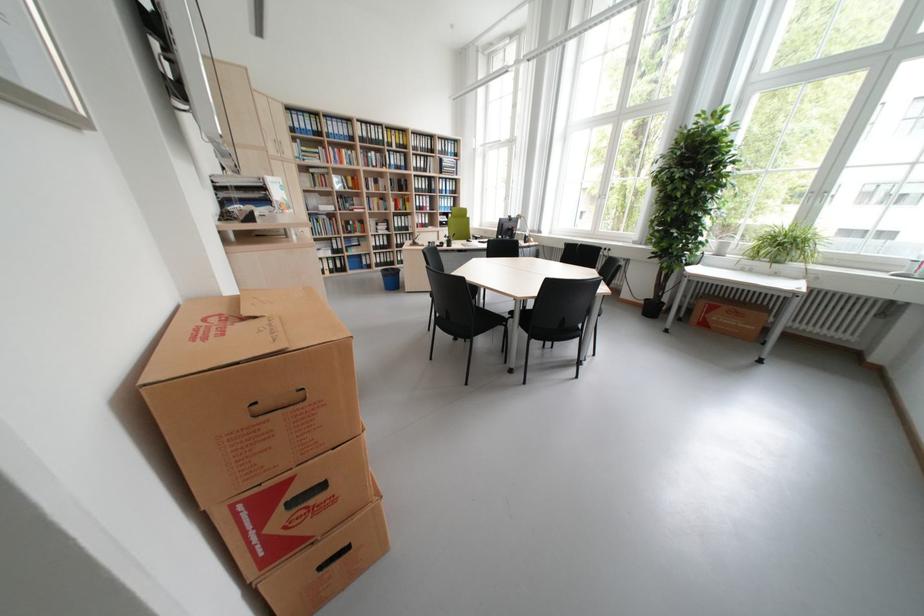
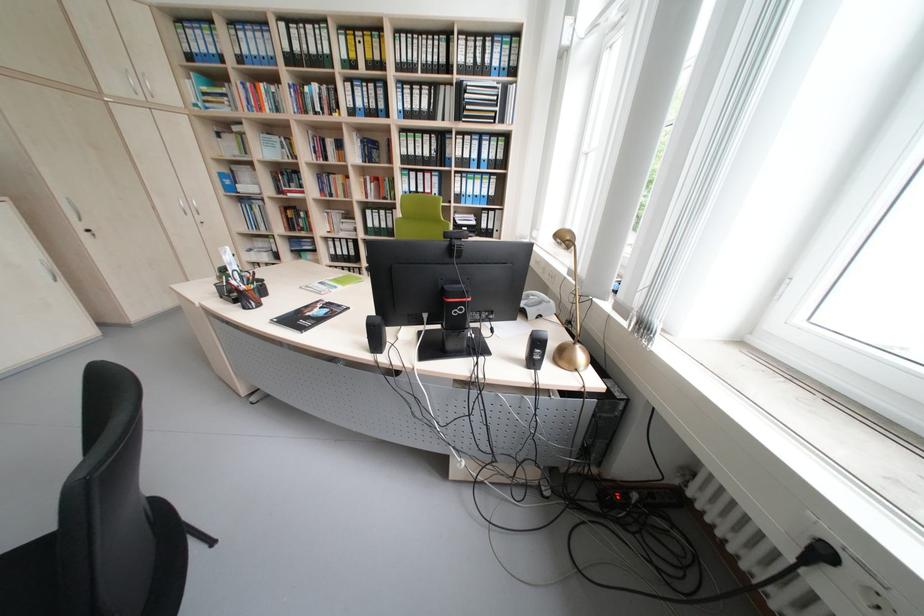
Where in the second image is the point corresponding to point (358, 225) from the first image?

(309, 217)